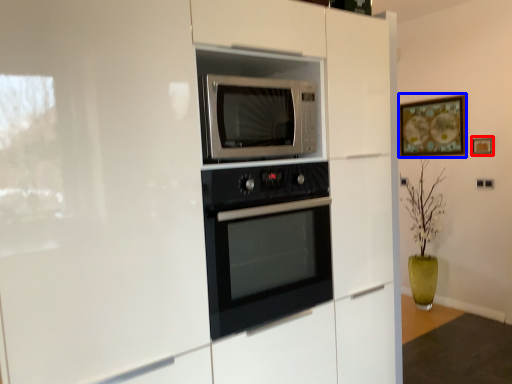
Question: Which of the following is the farthest to the observer, picture frame (highlighted by a red box) or picture frame (highlighted by a blue box)?

Choices:
 (A) picture frame
 (B) picture frame

Answer: (B)